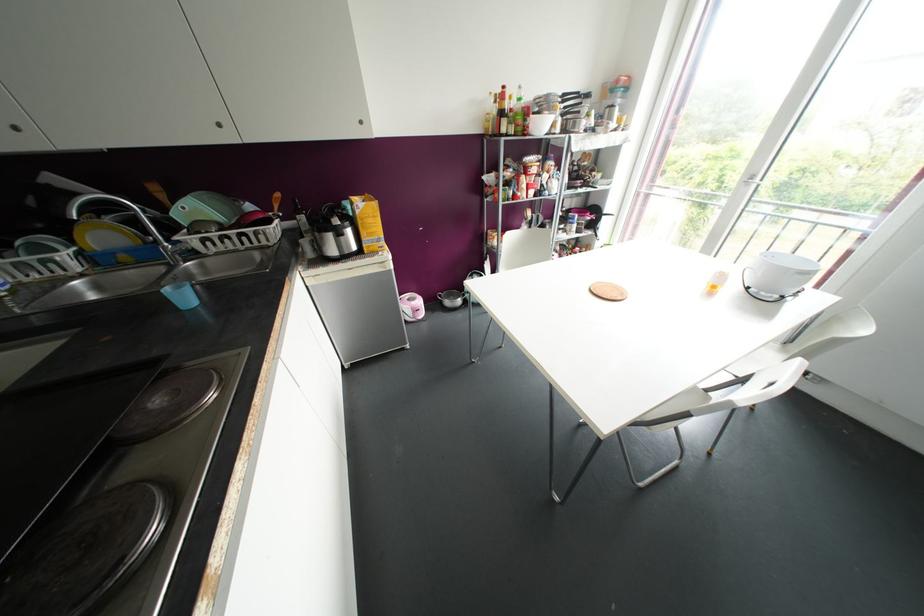
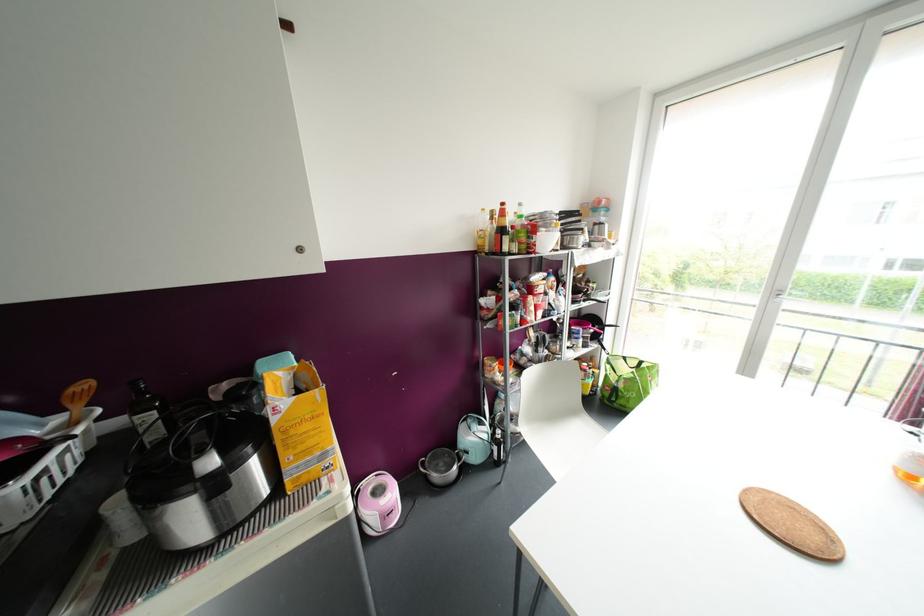
Consider the image. In a continuous first-person perspective shot, in which direction is the camera moving?

The movement direction of the cameraman is left, forward.